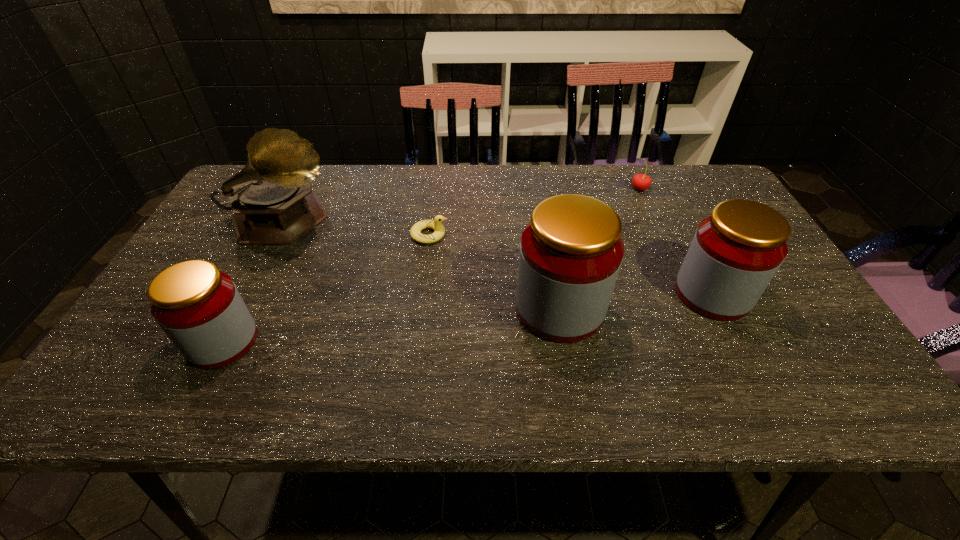
Find the location of `vacant space located 0.400m on the left of the third object from right to left`. vacant space located 0.400m on the left of the third object from right to left is located at coordinates (343, 309).

You are a GUI agent. You are given a task and a screenshot of the screen. Output one action in this format:
    pyautogui.click(x=<x>, y=<y>)
    Task: Click on the vacant region located on the left of the rightmost jar
    Image resolution: width=960 pixels, height=540 pixels.
    Given the screenshot: What is the action you would take?
    pyautogui.click(x=563, y=294)

You are a GUI agent. You are given a task and a screenshot of the screen. Output one action in this format:
    pyautogui.click(x=<x>, y=<y>)
    Task: Click on the free region located 0.100m on the horn direction of the phonograph record
    This screenshot has height=540, width=960.
    Given the screenshot: What is the action you would take?
    pyautogui.click(x=374, y=222)

Where is `free space located 0.240m on the face of the duckling`? The image size is (960, 540). free space located 0.240m on the face of the duckling is located at coordinates (536, 235).

Locate an element on the screen. The width and height of the screenshot is (960, 540). vacant area situated 0.260m on the left of the second shortest object is located at coordinates (546, 189).

Image resolution: width=960 pixels, height=540 pixels. Find the location of `phonograph record at the far edge`. phonograph record at the far edge is located at coordinates (272, 201).

Locate an element on the screen. cherry at the far edge is located at coordinates (641, 182).

I want to click on jar at the left edge, so click(199, 308).

The image size is (960, 540). I want to click on phonograph record that is at the left edge, so click(272, 201).

Where is `object that is at the right edge`? object that is at the right edge is located at coordinates (736, 251).